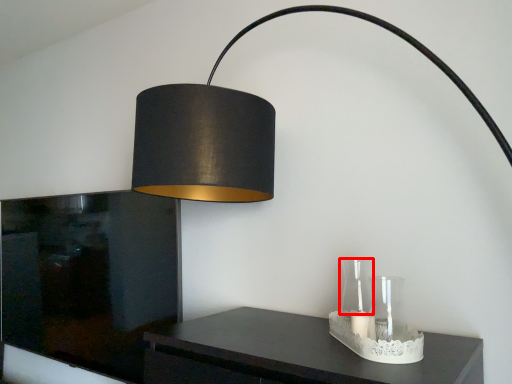
Question: Observing the image, what is the correct spatial positioning of glass vase (annotated by the red box) in reference to glass vase?

Choices:
 (A) left
 (B) right

Answer: (A)